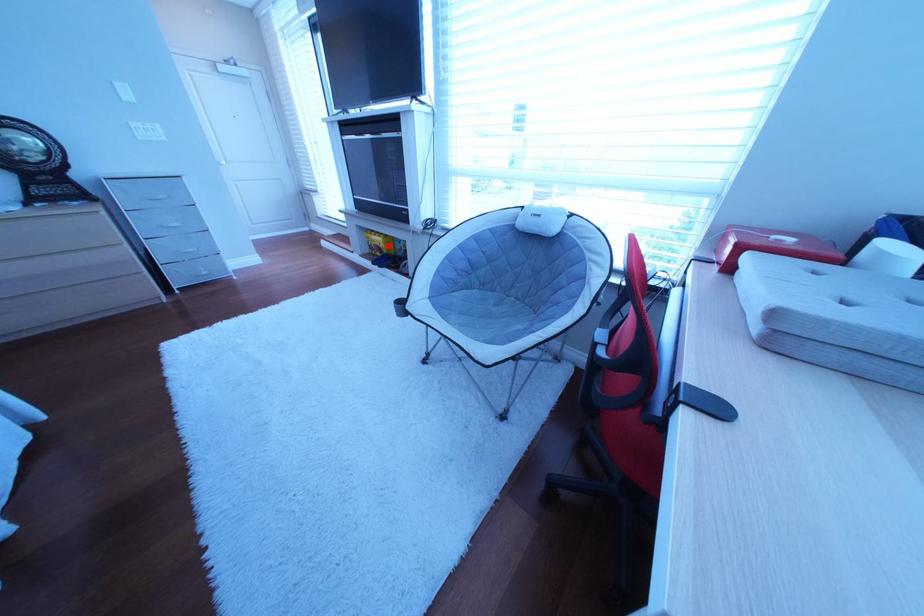
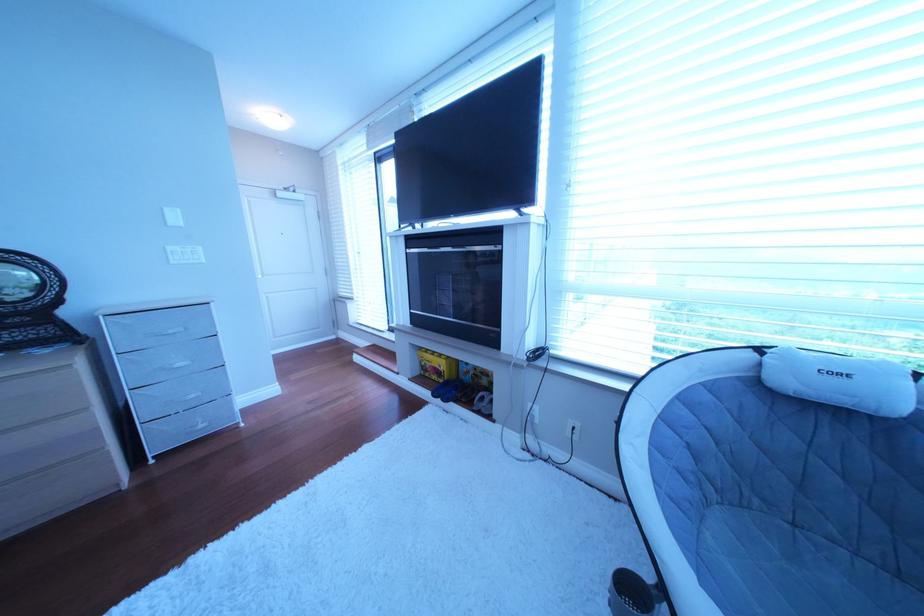
Question: I am providing you with two images of the same scene from different viewpoints. A red point is marked on the first image. At the location where the point appears in image 1, is it still visible in image 2?

Choices:
 (A) Yes
 (B) No

Answer: (A)